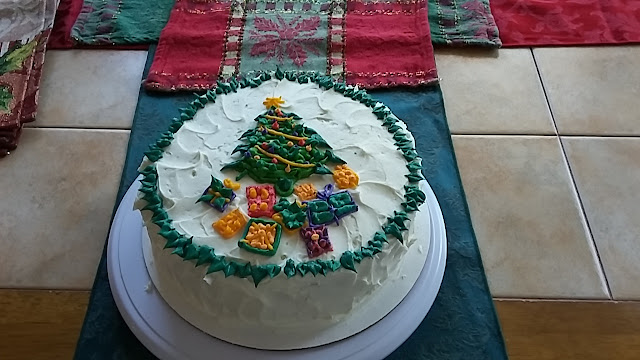
Locate an element on the screen. The height and width of the screenshot is (360, 640). cake tray is located at coordinates (127, 263), (404, 322), (438, 226), (122, 210), (147, 331).